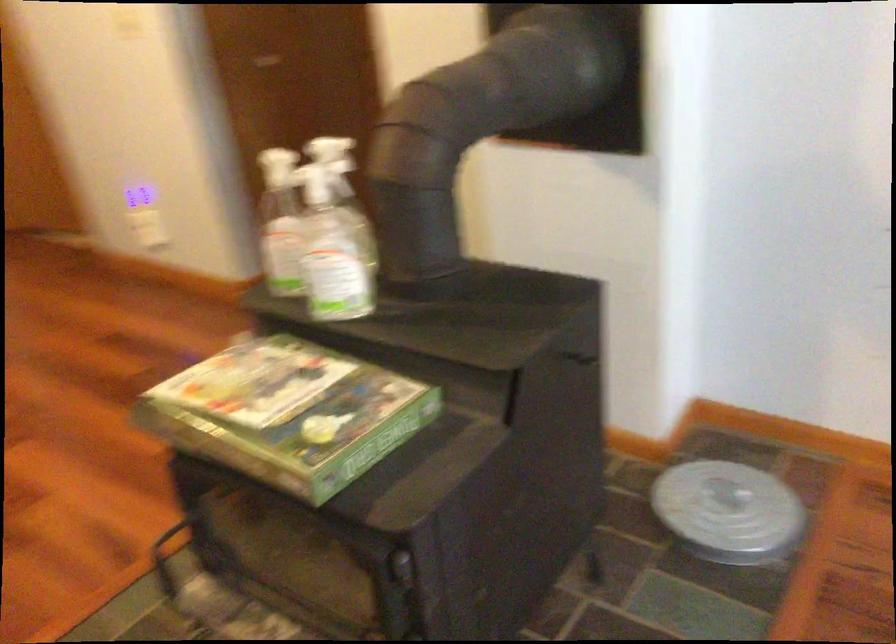
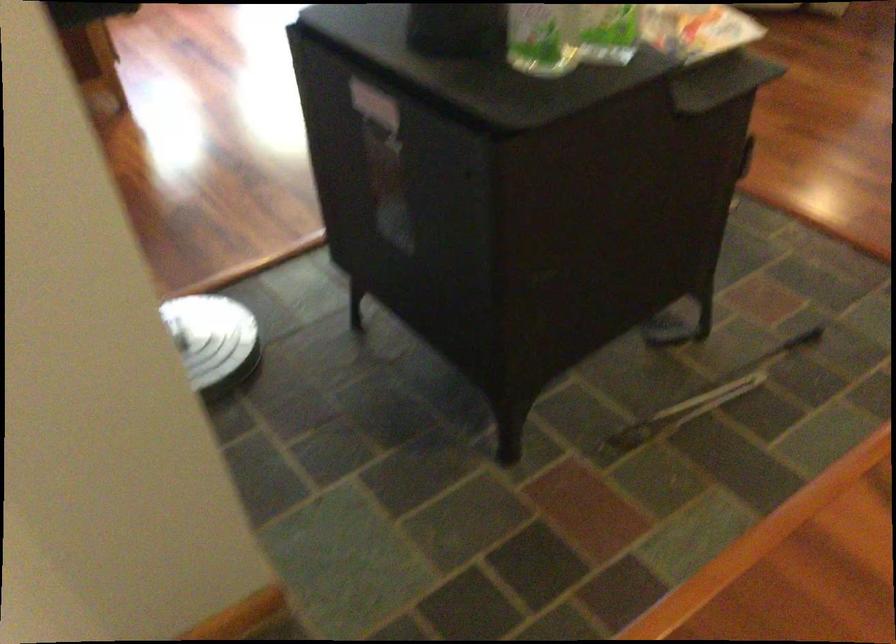
Find the pixel in the second image that matches [342,243] in the first image.

(541, 38)